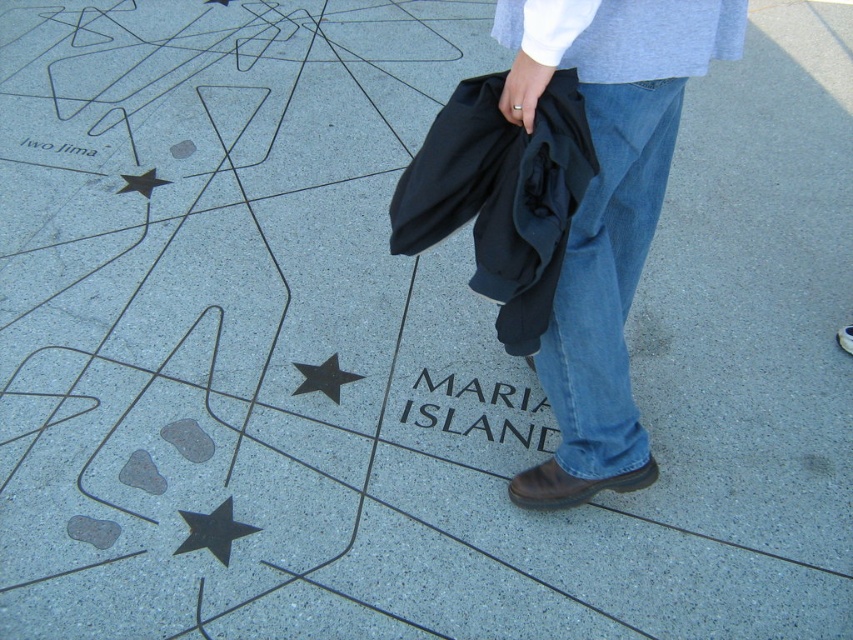
Is metallic black star at center taller than metallic star at center?

No.

Does metallic black star at center appear on the right side of metallic star at center?

Yes, metallic black star at center is to the right of metallic star at center.

Is point (329, 376) positioned in front of point (123, 188)?

Yes.

This screenshot has width=853, height=640. Find the location of `metallic black star at center`. metallic black star at center is located at coordinates (323, 378).

Can you confirm if denim jeans at center is taller than black paper at center?

Indeed, denim jeans at center has a greater height compared to black paper at center.

Does denim jeans at center have a lesser height compared to black paper at center?

No, denim jeans at center is not shorter than black paper at center.

Which is behind, point (645, 64) or point (82, 147)?

The point (82, 147) is more distant.

Locate an element on the screen. denim jeans at center is located at coordinates (606, 209).

Is metallic star at center to the left of black paper at center from the viewer's perspective?

Incorrect, metallic star at center is not on the left side of black paper at center.

Can you confirm if metallic star at center is thinner than black paper at center?

Yes.

Is point (138, 192) in front of point (90, 150)?

Yes, point (138, 192) is closer to viewer.

Identify the location of metallic star at center. This screenshot has height=640, width=853. (141, 182).